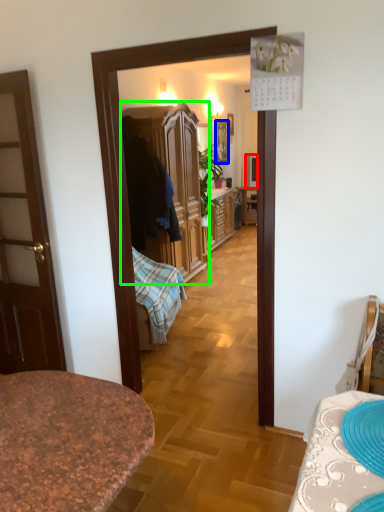
Question: Based on their relative distances, which object is farther from television (highlighted by a red box)? Choose from picture frame (highlighted by a blue box) and cabinetry (highlighted by a green box).

Choices:
 (A) picture frame
 (B) cabinetry

Answer: (B)